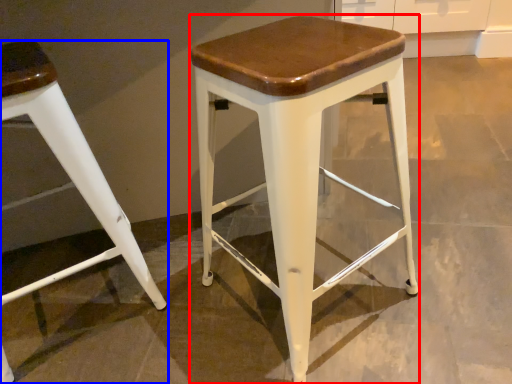
Question: Which object appears closest to the camera in this image, stool (highlighted by a red box) or stool (highlighted by a blue box)?

Choices:
 (A) stool
 (B) stool

Answer: (A)